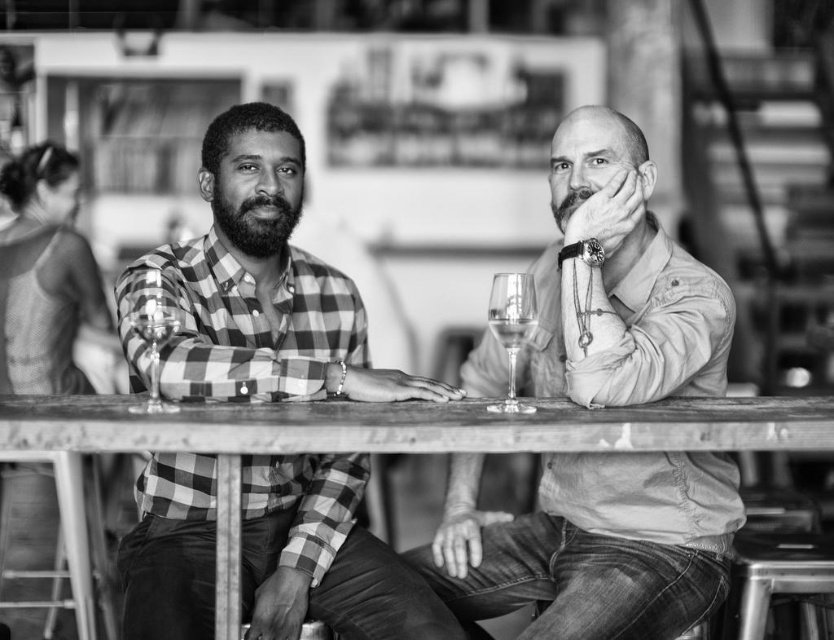
You are a bartender and need to choose between the clear glass wine glass at left and the clear glass at center for a customer who prefers wider glasses. Which one should you choose?

The clear glass wine glass at left has a greater width than the clear glass at center, so you should choose the clear glass wine glass at left for the customer who prefers wider glasses.

You are a photographer standing 2 meters away from the camera. You want to take a photo of the smooth beige shirt at center. Can you reach it with your hand without moving the camera?

The smooth beige shirt at center is 2.25 meters away from the camera. Since you are standing 2 meters away from the camera, the total distance between you and the shirt is 4.25 meters. Your hand cannot reach that far, so you cannot touch it without moving the camera.